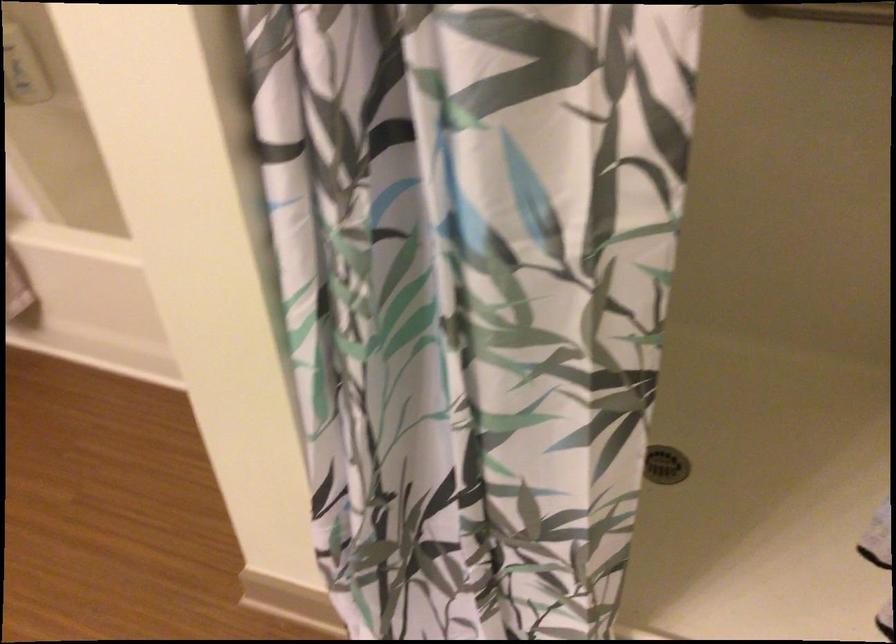
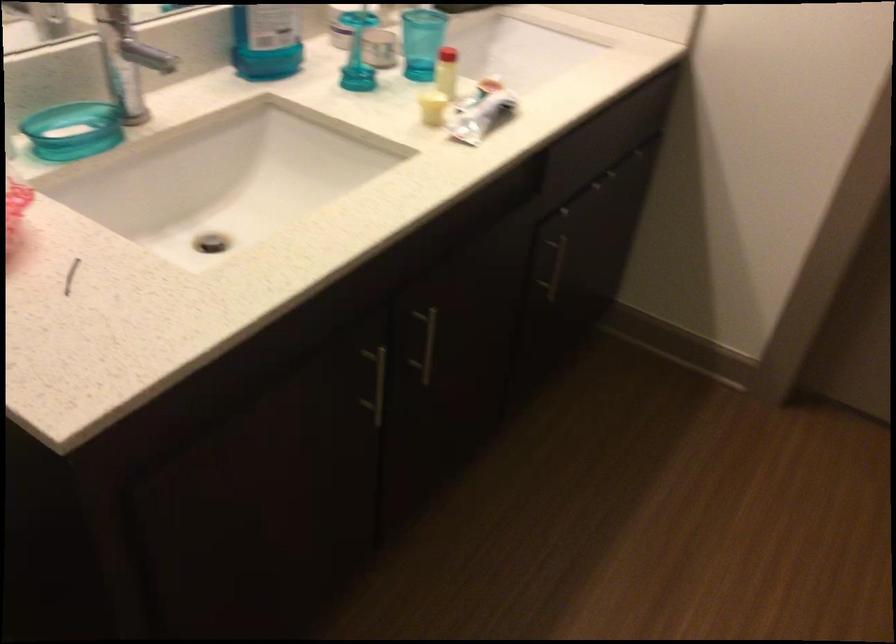
The images are taken continuously from a first-person perspective. In which direction is your viewpoint rotating?

The camera rotated toward left-down.